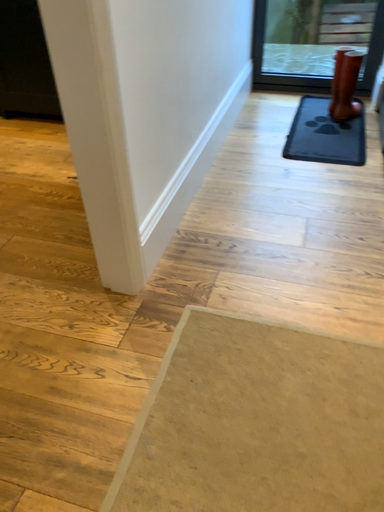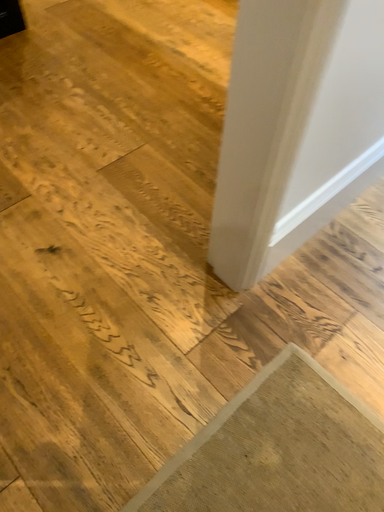
Question: How did the camera likely rotate when shooting the video?

Choices:
 (A) rotated upward
 (B) rotated downward

Answer: (B)